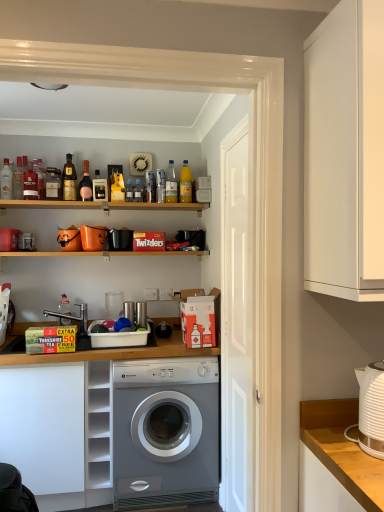
The image size is (384, 512). In order to click on vacant space in front of shiny gold bottle at upper left, acting as the 6th bottle starting from the right in this screenshot , I will do `click(69, 200)`.